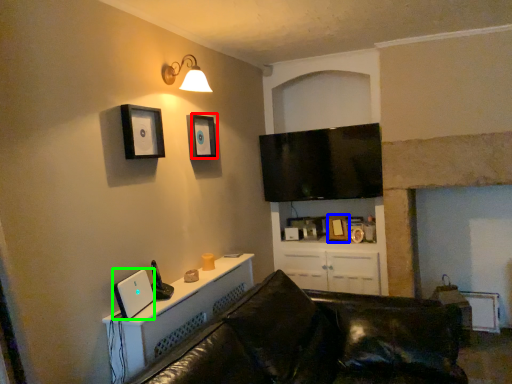
Question: Which object is positioned closest to picture frame (highlighted by a red box)? Select from picture frame (highlighted by a blue box) and desktop computer (highlighted by a green box).

Choices:
 (A) picture frame
 (B) desktop computer

Answer: (B)